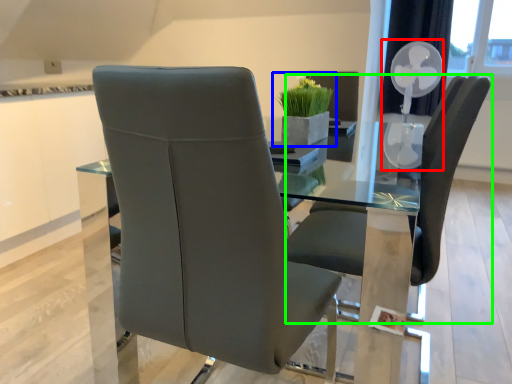
Question: Based on their relative distances, which object is farther from fan (highlighted by a red box)? Choose from houseplant (highlighted by a blue box) and chair (highlighted by a green box).

Choices:
 (A) houseplant
 (B) chair

Answer: (B)